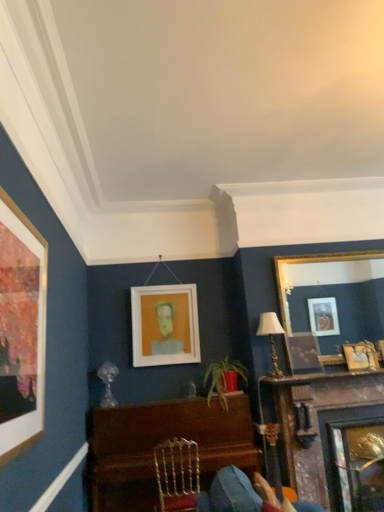
Question: From the image's perspective, relative to matte gold lampshade at upper right, is matte gold picture frame at upper right, the fourth picture frame viewed from the left, above or below?

Choices:
 (A) below
 (B) above

Answer: (A)

Question: Considering the positions of matte gold picture frame at upper right, marked as the 1th picture frame in a right-to-left arrangement, and matte gold lampshade at upper right in the image, is matte gold picture frame at upper right, marked as the 1th picture frame in a right-to-left arrangement, wider or thinner than matte gold lampshade at upper right?

Choices:
 (A) thin
 (B) wide

Answer: (A)

Question: Which is nearer to the matte wooden picture frame at upper right, the 2th picture frame viewed from the left?

Choices:
 (A) gold/gilded mirror at upper right, the 3th picture frame in the left-to-right sequence
 (B) polished wood piano at center
 (C) dark wood fireplace at lower right
 (D) white matte picture frame at upper center, which is the 4th picture frame from right to left
 (E) matte gold picture frame at upper right, marked as the 1th picture frame in a right-to-left arrangement

Answer: (E)

Question: Which of these objects is positioned closest to the matte gold picture frame at upper right, marked as the 1th picture frame in a right-to-left arrangement?

Choices:
 (A) dark wood fireplace at lower right
 (B) matte wooden picture frame at upper right, the 3th picture frame in the right-to-left sequence
 (C) white matte picture frame at upper center, which is the 4th picture frame from right to left
 (D) gold/gilded mirror at upper right, the 3th picture frame in the left-to-right sequence
 (E) polished wood piano at center

Answer: (B)